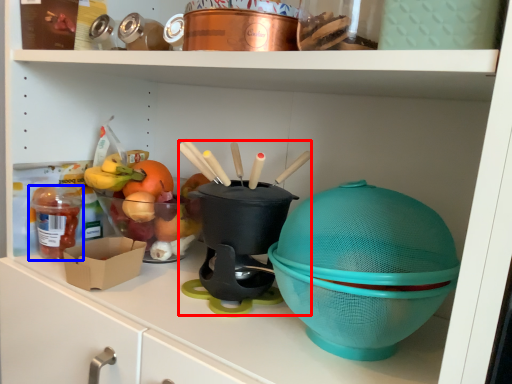
Question: Which point is closer to the camera, appliance (highlighted by a red box) or food (highlighted by a blue box)?

Choices:
 (A) appliance
 (B) food

Answer: (A)